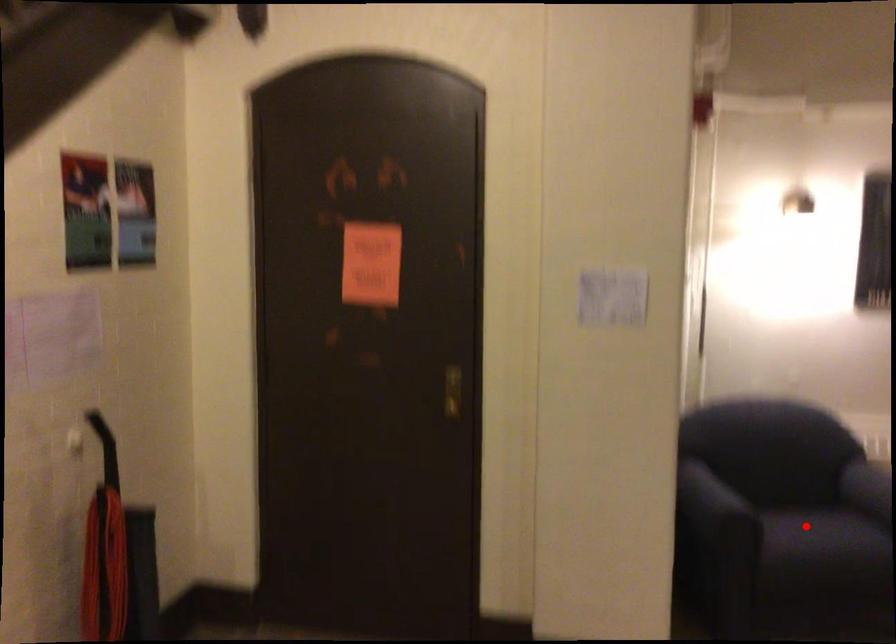
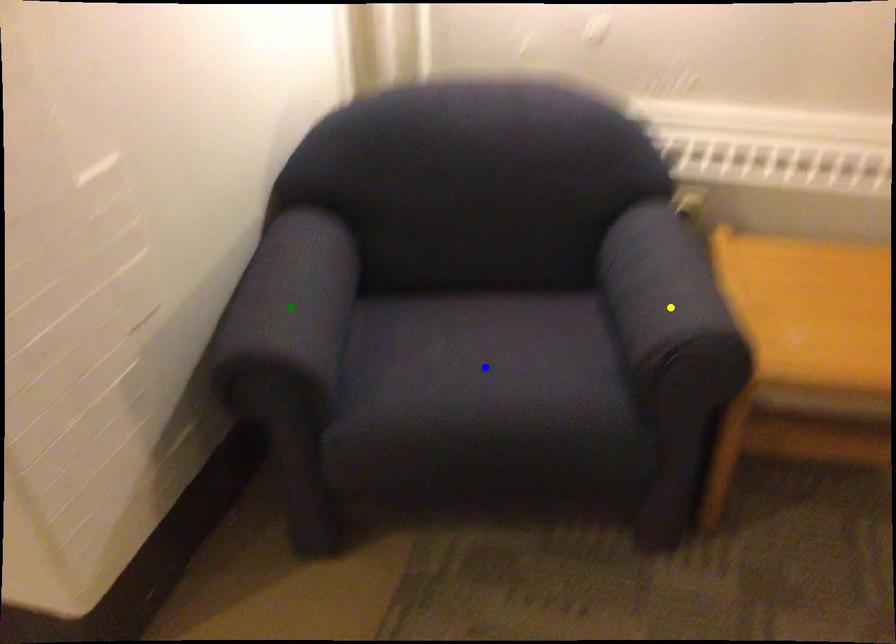
Question: I am providing you with two images of the same scene from different viewpoints. A red point is marked on the first image. You are given multiple points on the second image. Can you choose the point in image 2 that corresponds to the point in image 1?

Choices:
 (A) blue point
 (B) green point
 (C) yellow point

Answer: (A)